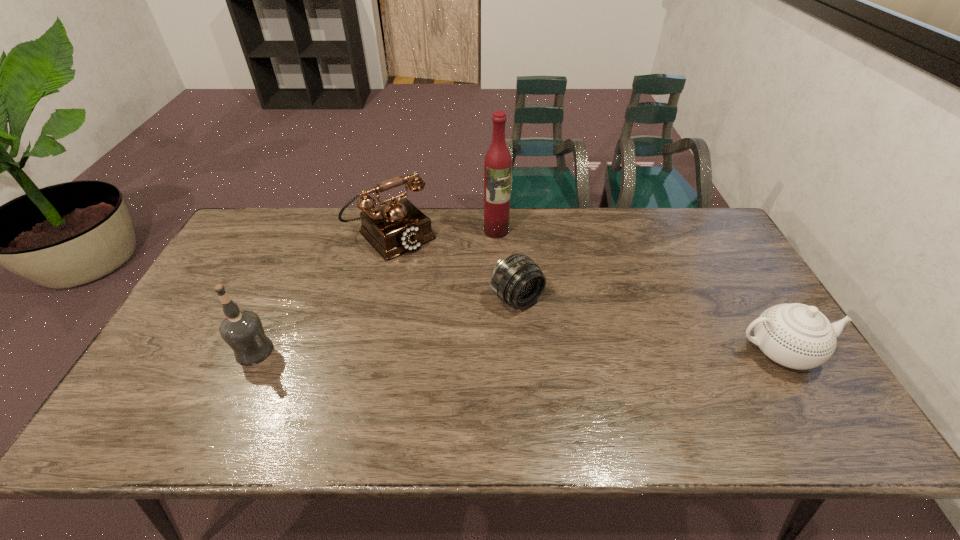
Image resolution: width=960 pixels, height=540 pixels. I want to click on free space located on the label of the liquor, so click(x=516, y=292).

This screenshot has width=960, height=540. I want to click on vacant space located on the label of the liquor, so click(515, 287).

Where is `vacant space located on the label of the liquor`? The width and height of the screenshot is (960, 540). vacant space located on the label of the liquor is located at coordinates (505, 258).

The image size is (960, 540). I want to click on vacant region located at the front element of the shortest object, so click(x=629, y=399).

Find the location of a particular element. The image size is (960, 540). free space located 0.320m at the front element of the shortest object is located at coordinates (626, 395).

The width and height of the screenshot is (960, 540). Find the location of `free spot located 0.330m at the front element of the shortest object`. free spot located 0.330m at the front element of the shortest object is located at coordinates (629, 399).

This screenshot has height=540, width=960. In order to click on vacant point located 0.190m on the dial of the fourth object from right to left in this screenshot , I will do `click(448, 289)`.

Find the location of a particular element. The image size is (960, 540). blank space located on the dial of the fourth object from right to left is located at coordinates (456, 298).

Identify the location of free region located 0.360m on the dial of the fourth object from right to left. This screenshot has width=960, height=540. 484,325.

This screenshot has height=540, width=960. Find the location of `liquor that is at the far edge`. liquor that is at the far edge is located at coordinates (498, 162).